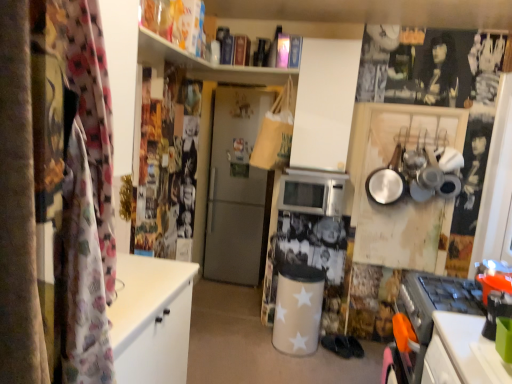
Describe the element at coordinates (312, 193) in the screenshot. I see `silver metallic microwave at center` at that location.

At what (x,y) coordinates should I click in order to perform the action: click on silver metallic microwave at center. Please return your answer as a coordinate pair (x, y). This screenshot has width=512, height=384. Looking at the image, I should click on (312, 193).

Based on the photo, measure the distance between point (261, 178) and camera.

Point (261, 178) and camera are 13.74 feet apart from each other.

At what (x,y) coordinates should I click in order to perform the action: click on silver metallic microwave at center. Please return your answer as a coordinate pair (x, y). This screenshot has width=512, height=384. Looking at the image, I should click on (312, 193).

Between satin silver refrigerator at center and black fabric shoe at center, which one has larger width?

satin silver refrigerator at center.

Does satin silver refrigerator at center have a lesser height compared to black fabric shoe at center?

Incorrect, the height of satin silver refrigerator at center does not fall short of that of black fabric shoe at center.

From the picture: Is satin silver refrigerator at center turned away from black fabric shoe at center?

No, black fabric shoe at center is not at the back of satin silver refrigerator at center.

Find the location of a particular element. door directly beneath the silver metallic microwave at center (from a real-world perspective) is located at coordinates (237, 190).

Is satin silver refrigerator at center to the right of silver metallic microwave at center from the viewer's perspective?

Incorrect, satin silver refrigerator at center is not on the right side of silver metallic microwave at center.

Looking at the image, does satin silver refrigerator at center seem bigger or smaller compared to silver metallic microwave at center?

In the image, satin silver refrigerator at center appears to be larger than silver metallic microwave at center.

Between point (337, 187) and point (350, 354), which one is positioned in front?

The point (337, 187) is more forward.

Is silver metallic microwave at center positioned with its back to black fabric shoe at center?

silver metallic microwave at center does not have its back to black fabric shoe at center.

Looking at their sizes, would you say silver metallic microwave at center is wider or thinner than black fabric shoe at center?

silver metallic microwave at center is wider than black fabric shoe at center.

Is satin silver refrigerator at center completely or partially inside black fabric shoe at center?

No, satin silver refrigerator at center is not surrounded by black fabric shoe at center.

From the picture: Is black fabric shoe at center not close to satin silver refrigerator at center?

Yes, black fabric shoe at center and satin silver refrigerator at center are quite far apart.

Considering the sizes of objects black fabric shoe at center and satin silver refrigerator at center in the image provided, who is smaller, black fabric shoe at center or satin silver refrigerator at center?

black fabric shoe at center.

From a real-world perspective, is black fabric shoe at center under satin silver refrigerator at center?

Indeed, from a real-world perspective, black fabric shoe at center is positioned beneath satin silver refrigerator at center.

Is the depth of black fabric shoe at center greater than that of silver metallic microwave at center?

Yes, black fabric shoe at center is further from the camera.

From the image's perspective, which object appears higher, black fabric shoe at center or silver metallic microwave at center?

From the image's view, silver metallic microwave at center is above.

Is black fabric shoe at center aimed at silver metallic microwave at center?

No, black fabric shoe at center is not oriented towards silver metallic microwave at center.

Is black fabric shoe at center next to silver metallic microwave at center?

No.

Which object is closer to the camera, silver metallic microwave at center or satin silver refrigerator at center?

silver metallic microwave at center is in front.

Considering the sizes of silver metallic microwave at center and satin silver refrigerator at center in the image, is silver metallic microwave at center taller or shorter than satin silver refrigerator at center?

Considering their sizes, silver metallic microwave at center has less height than satin silver refrigerator at center.

Is point (327, 185) in front of point (222, 263)?

Yes, point (327, 185) is in front of point (222, 263).

In the image, is silver metallic microwave at center on the left side or the right side of satin silver refrigerator at center?

silver metallic microwave at center is positioned on satin silver refrigerator at center's right side.

Image resolution: width=512 pixels, height=384 pixels. What are the coordinates of `footwear below the satin silver refrigerator at center (from the image's perspective)` in the screenshot? It's located at (337, 345).

You are a GUI agent. You are given a task and a screenshot of the screen. Output one action in this format:
    pyautogui.click(x=<x>, y=<y>)
    Task: Click on the microwave oven above the satin silver refrigerator at center (from a real-world perspective)
    The image size is (512, 384).
    Given the screenshot: What is the action you would take?
    pyautogui.click(x=312, y=193)

Considering their positions, is silver metallic microwave at center positioned closer to satin silver refrigerator at center than black fabric shoe at center?

silver metallic microwave at center lies closer to satin silver refrigerator at center than the other object.

From the image, which object appears to be farther from black fabric shoe at center, satin silver refrigerator at center or silver metallic microwave at center?

satin silver refrigerator at center is positioned further to the anchor black fabric shoe at center.

Looking at the image, which one is located further to black fabric shoe at center, silver metallic microwave at center or satin silver refrigerator at center?

satin silver refrigerator at center.

Considering their positions, is satin silver refrigerator at center positioned closer to silver metallic microwave at center than black fabric shoe at center?

black fabric shoe at center is positioned closer to the anchor silver metallic microwave at center.

Estimate the real-world distances between objects in this image. Which object is closer to silver metallic microwave at center, black fabric shoe at center or satin silver refrigerator at center?

Based on the image, black fabric shoe at center appears to be nearer to silver metallic microwave at center.

Looking at the image, which one is located closer to satin silver refrigerator at center, black fabric shoe at center or silver metallic microwave at center?

silver metallic microwave at center.

The image size is (512, 384). I want to click on door between silver metallic microwave at center and black fabric shoe at center from top to bottom, so click(237, 190).